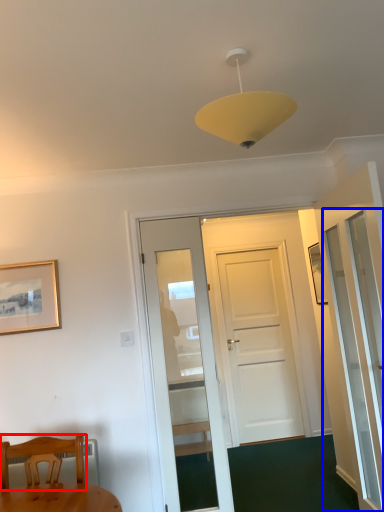
Question: Which object appears farthest to the camera in this image, chair (highlighted by a red box) or screen door (highlighted by a blue box)?

Choices:
 (A) chair
 (B) screen door

Answer: (B)